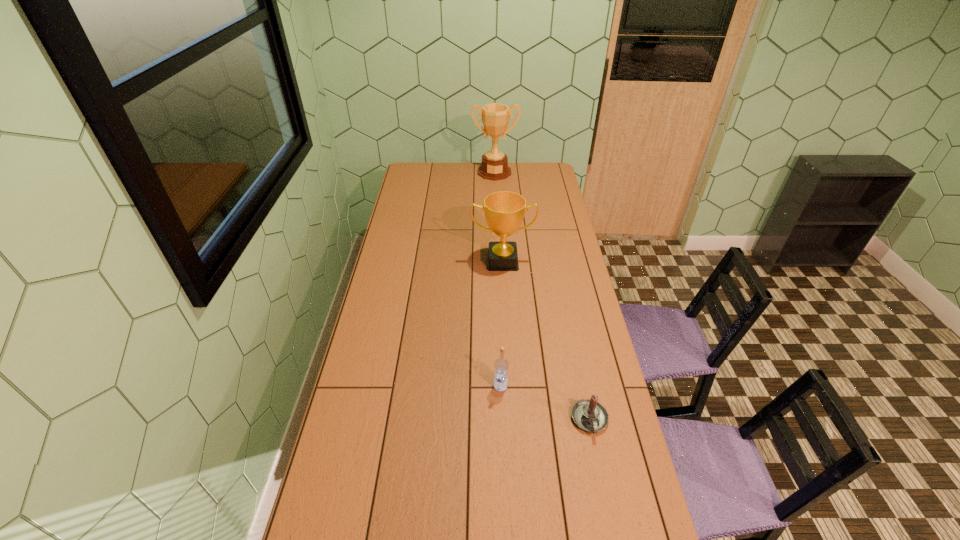
Where is `free spot between the vodka and the nearer award`? This screenshot has height=540, width=960. free spot between the vodka and the nearer award is located at coordinates (501, 323).

The height and width of the screenshot is (540, 960). I want to click on the third closest object to the tallest object, so click(588, 414).

The image size is (960, 540). I want to click on object that is the closest one to the shorter award, so click(501, 365).